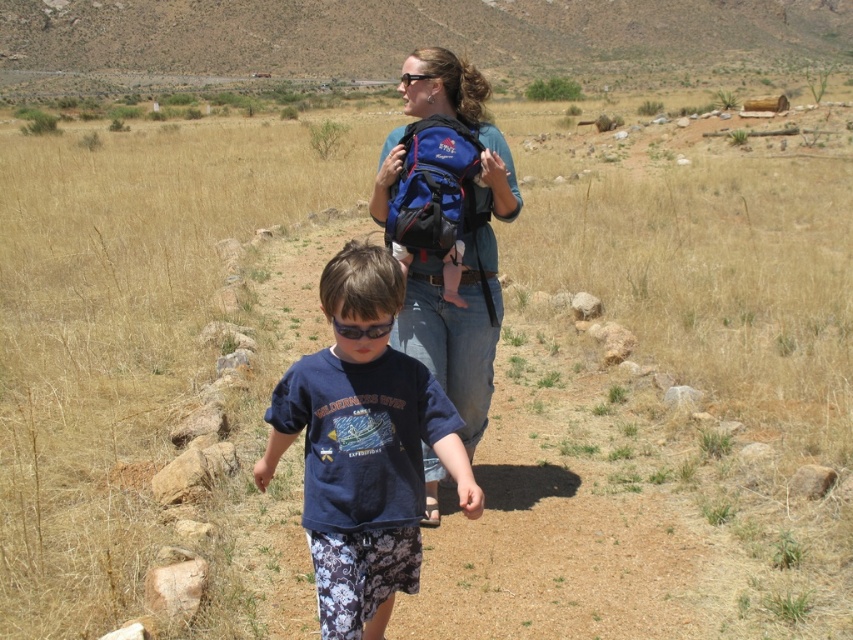
Consider the image. You are a hiker planning to take a photo of the blue cotton shirt at center and the blue fabric backpack at upper center. Which object should you focus on first if you want to capture both in a single frame without moving the camera?

The blue cotton shirt at center should be focused on first because it is shorter than the blue fabric backpack at upper center, so adjusting focus starting from the lower position ensures both are in frame.